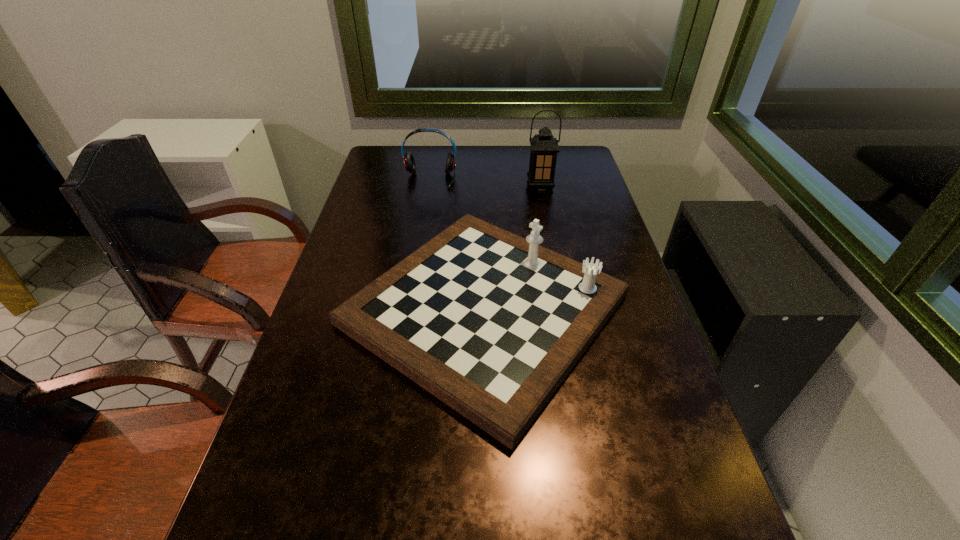
The image size is (960, 540). What are the coordinates of `gameboard present at the right edge` in the screenshot? It's located at (490, 323).

The width and height of the screenshot is (960, 540). Find the location of `object located in the far left corner section of the desktop`. object located in the far left corner section of the desktop is located at coordinates (409, 162).

This screenshot has height=540, width=960. In order to click on free point at the far edge in this screenshot , I will do `click(420, 148)`.

Image resolution: width=960 pixels, height=540 pixels. I want to click on free space at the left edge of the desktop, so click(274, 427).

Identify the location of vacant area at the right edge. This screenshot has width=960, height=540. (696, 505).

The height and width of the screenshot is (540, 960). In the image, there is a desktop. Find the location of `vacant space at the far left corner`. vacant space at the far left corner is located at coordinates (397, 171).

Find the location of a particular element. The width and height of the screenshot is (960, 540). vacant space that is in between the headset and the tallest object is located at coordinates (485, 184).

Find the location of a particular element. object that is the closest to the gameboard is located at coordinates tap(544, 147).

Identify which object is located as the second nearest to the nearest object. Please provide its 2D coordinates. Your answer should be formatted as a tuple, i.e. [(x, y)], where the tuple contains the x and y coordinates of a point satisfying the conditions above.

[(409, 162)]

Where is `vacant space that satisfies the following two spatial constraints: 1. with the microphone attached to the side of the headset; 2. on the left side of the tallest object`? The width and height of the screenshot is (960, 540). vacant space that satisfies the following two spatial constraints: 1. with the microphone attached to the side of the headset; 2. on the left side of the tallest object is located at coordinates point(428,187).